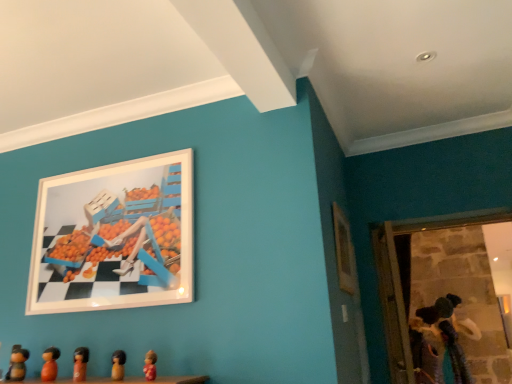
Question: Can we say wooden figurine at lower left, the sixth toy viewed from the right, lies outside white glossy picture frame at upper left, the first picture frame when ordered from left to right?

Choices:
 (A) no
 (B) yes

Answer: (B)

Question: Considering the relative positions of wooden figurine at lower left, acting as the second toy starting from the bottom, and white glossy picture frame at upper left, the first picture frame when ordered from left to right, in the image provided, is wooden figurine at lower left, acting as the second toy starting from the bottom, to the left of white glossy picture frame at upper left, the first picture frame when ordered from left to right, from the viewer's perspective?

Choices:
 (A) yes
 (B) no

Answer: (A)

Question: Is wooden figurine at lower left, the fifth toy when ordered from top to bottom, oriented towards white glossy picture frame at upper left, the second picture frame from the right?

Choices:
 (A) yes
 (B) no

Answer: (B)

Question: Is wooden figurine at lower left, the 5th toy positioned from the front, facing away from white glossy picture frame at upper left, the first picture frame when ordered from left to right?

Choices:
 (A) yes
 (B) no

Answer: (B)

Question: Is wooden figurine at lower left, which ranks as the 2th toy in back-to-front order, directly adjacent to white glossy picture frame at upper left, the second picture frame from the right?

Choices:
 (A) yes
 (B) no

Answer: (B)

Question: From a real-world perspective, is matte pink figurine at lower center, which is the first toy from front to back, physically located above or below wooden figurine at lower left, acting as the second toy starting from the bottom?

Choices:
 (A) above
 (B) below

Answer: (B)

Question: Considering the positions of matte pink figurine at lower center, which is the first toy from front to back, and wooden figurine at lower left, the 1th toy positioned from the left, in the image, is matte pink figurine at lower center, which is the first toy from front to back, taller or shorter than wooden figurine at lower left, the 1th toy positioned from the left,?

Choices:
 (A) short
 (B) tall

Answer: (A)

Question: Considering the positions of point (156, 355) and point (22, 362), is point (156, 355) closer or farther from the camera than point (22, 362)?

Choices:
 (A) closer
 (B) farther

Answer: (A)

Question: Is matte pink figurine at lower center, positioned as the 6th toy in bottom-to-top order, to the left or to the right of wooden figurine at lower left, the fifth toy when ordered from top to bottom, in the image?

Choices:
 (A) left
 (B) right

Answer: (B)

Question: From the image's perspective, is velvet plush doll at lower right, which appears as the sixth toy when viewed from the top, located above or below wooden figurine at lower center, acting as the 4th toy starting from the left?

Choices:
 (A) below
 (B) above

Answer: (A)

Question: In terms of height, does velvet plush doll at lower right, which is the first toy from right to left, look taller or shorter compared to wooden figurine at lower center, the second toy from the top?

Choices:
 (A) tall
 (B) short

Answer: (A)

Question: Based on their positions, is velvet plush doll at lower right, arranged as the 1th toy when viewed from the back, located to the left or right of wooden figurine at lower center, the 3th toy positioned from the right?

Choices:
 (A) left
 (B) right

Answer: (B)

Question: From a real-world perspective, is velvet plush doll at lower right, arranged as the 1th toy when viewed from the back, above or below wooden figurine at lower center, acting as the 4th toy starting from the left?

Choices:
 (A) below
 (B) above

Answer: (A)

Question: In terms of width, does white glossy picture frame at upper left, the second picture frame from the right, look wider or thinner when compared to wooden figurines at lower center?

Choices:
 (A) wide
 (B) thin

Answer: (B)

Question: From the image's perspective, is white glossy picture frame at upper left, the first picture frame when ordered from left to right, above or below wooden figurines at lower center?

Choices:
 (A) above
 (B) below

Answer: (A)